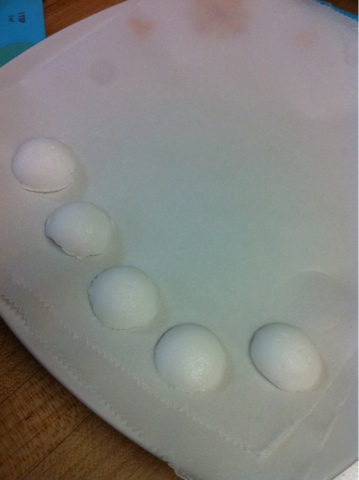
Locate an element on the screen. plate is located at coordinates (343, 449).